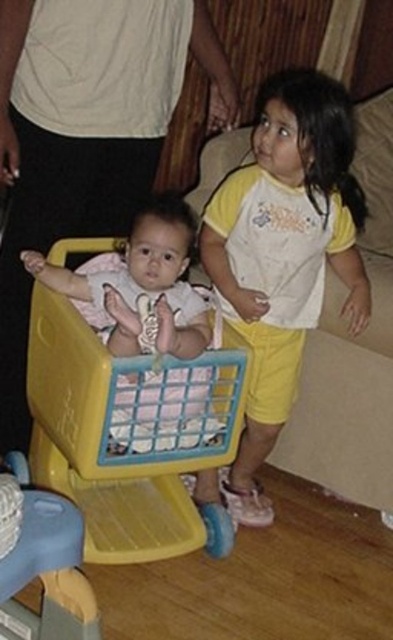
Question: Does white fabric shirt at upper center appear under yellow cotton shorts at center?

Choices:
 (A) yes
 (B) no

Answer: (B)

Question: Which object is farther from the camera taking this photo?

Choices:
 (A) yellow cotton shorts at center
 (B) yellow plastic shopping cart at center
 (C) white fabric shirt at upper center

Answer: (A)

Question: Can you confirm if white fabric shirt at upper center is thinner than yellow cotton shorts at center?

Choices:
 (A) no
 (B) yes

Answer: (A)

Question: Which object is farther from the camera taking this photo?

Choices:
 (A) yellow plastic shopping cart at center
 (B) white fabric shirt at upper center

Answer: (B)

Question: Which of the following is the farthest from the observer?

Choices:
 (A) (284, 84)
 (B) (106, 376)

Answer: (A)

Question: From the image, what is the correct spatial relationship of white fabric shirt at upper center in relation to yellow cotton shorts at center?

Choices:
 (A) above
 (B) below

Answer: (A)